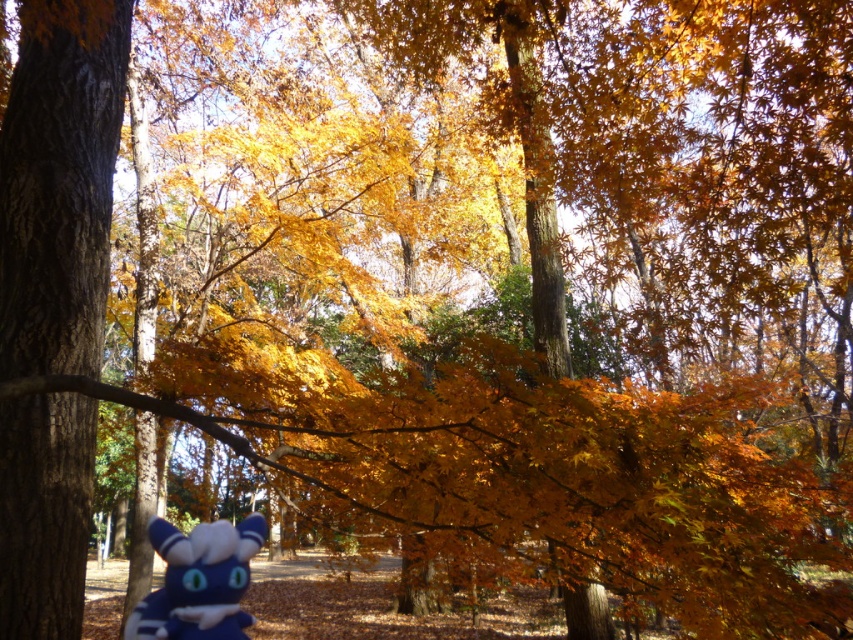
Question: Is brown rough bark tree at left behind blue plush toy at lower center?

Choices:
 (A) yes
 (B) no

Answer: (B)

Question: Does brown rough bark tree at left come in front of blue plush toy at lower center?

Choices:
 (A) yes
 (B) no

Answer: (A)

Question: In this image, where is brown rough bark tree at left located relative to blue plush toy at lower center?

Choices:
 (A) above
 (B) below

Answer: (A)